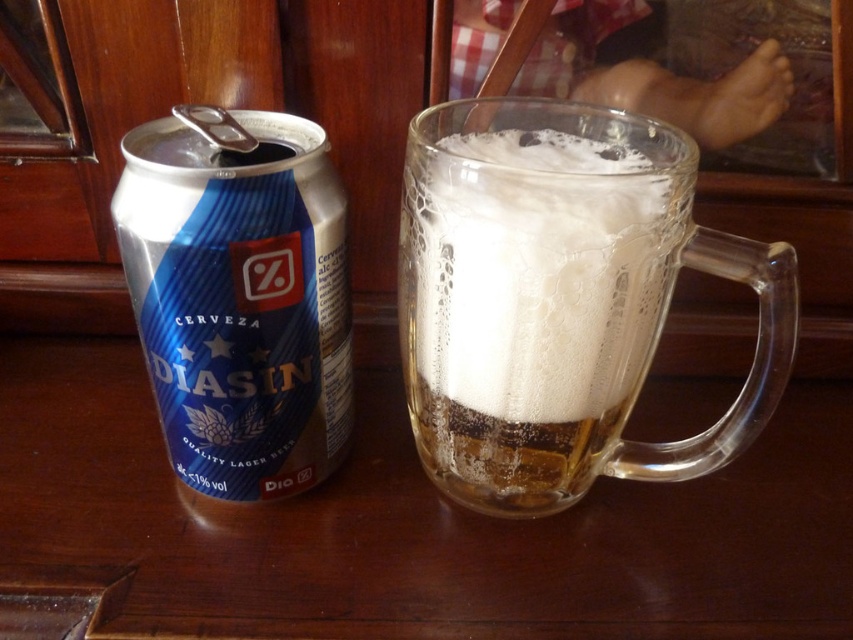
Question: Which object is the closest to the blue metallic can at left?

Choices:
 (A) white frothy foam at upper center
 (B) clear glass mug at center

Answer: (A)

Question: Which of the following is the farthest from the observer?

Choices:
 (A) (419, 320)
 (B) (419, 314)

Answer: (A)

Question: Can you confirm if clear glass mug at center is thinner than blue metallic can at left?

Choices:
 (A) yes
 (B) no

Answer: (B)

Question: Does clear glass mug at center appear over white frothy foam at upper center?

Choices:
 (A) no
 (B) yes

Answer: (A)

Question: Which of the following is the closest to the observer?

Choices:
 (A) white frothy foam at upper center
 (B) clear glass mug at center

Answer: (B)

Question: Does blue metallic can at left have a greater width compared to white frothy foam at upper center?

Choices:
 (A) no
 (B) yes

Answer: (A)